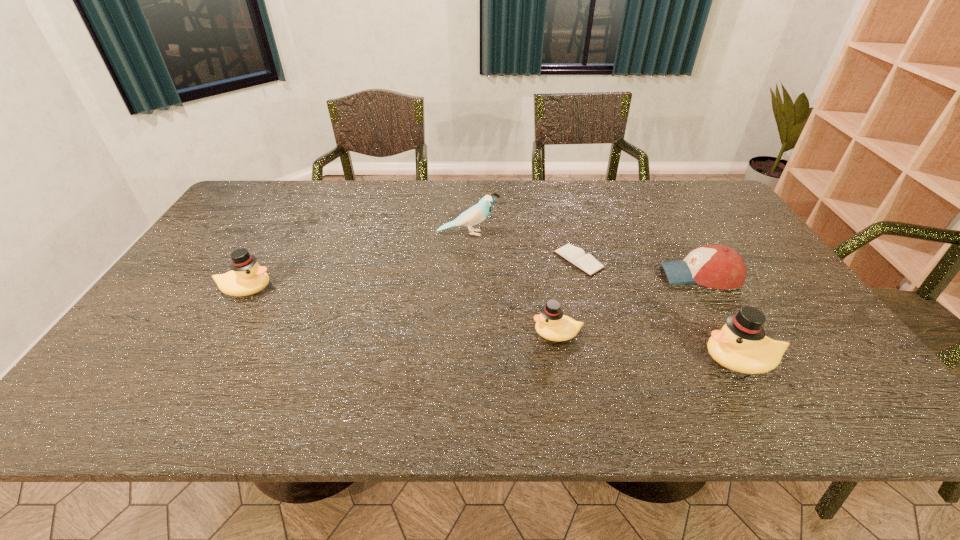
Select which object is the closest to the leftmost object. Please provide its 2D coordinates. Your answer should be formatted as a tuple, i.e. [(x, y)], where the tuple contains the x and y coordinates of a point satisfying the conditions above.

[(476, 214)]

Identify which object is the second closest to the baseball cap. Please provide its 2D coordinates. Your answer should be formatted as a tuple, i.e. [(x, y)], where the tuple contains the x and y coordinates of a point satisfying the conditions above.

[(741, 345)]

Locate an element on the screen. duck that is the second nearest to the rightmost duck is located at coordinates (247, 277).

The height and width of the screenshot is (540, 960). Identify the location of duck that is the second nearest to the fourth shortest object. (741, 345).

Where is `vacant space that satisfies the following two spatial constraints: 1. at the face of the diary; 2. on the left side of the second object from left to right`? This screenshot has height=540, width=960. vacant space that satisfies the following two spatial constraints: 1. at the face of the diary; 2. on the left side of the second object from left to right is located at coordinates (467, 260).